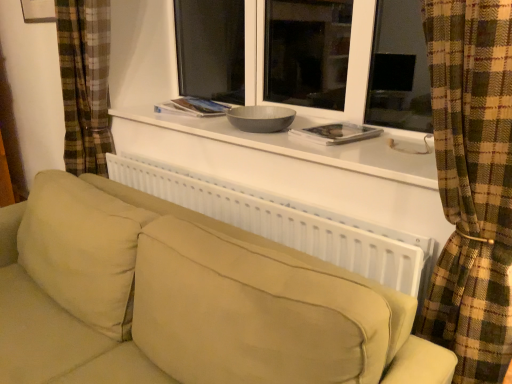
Question: Can you confirm if hardcover book at center, the 1th book from the left, is shorter than white plastic radiator at center?

Choices:
 (A) yes
 (B) no

Answer: (A)

Question: Does hardcover book at center, the 1th book from the left, lie in front of white plastic radiator at center?

Choices:
 (A) no
 (B) yes

Answer: (A)

Question: From a real-world perspective, is hardcover book at center, positioned as the 2th book in right-to-left order, located beneath white plastic radiator at center?

Choices:
 (A) no
 (B) yes

Answer: (A)

Question: From the image's perspective, is hardcover book at center, the second book when ordered from bottom to top, located above white plastic radiator at center?

Choices:
 (A) yes
 (B) no

Answer: (A)

Question: Is hardcover book at center, the 1th book positioned from the back, to the right of white plastic radiator at center from the viewer's perspective?

Choices:
 (A) yes
 (B) no

Answer: (B)

Question: Is hardcover book at center, the 1th book positioned from the back, looking in the opposite direction of white plastic radiator at center?

Choices:
 (A) yes
 (B) no

Answer: (B)

Question: Considering the relative sizes of hardcover book at center, the second book when ordered from bottom to top, and white paper book at center, marked as the 2th book in a left-to-right arrangement, in the image provided, is hardcover book at center, the second book when ordered from bottom to top, wider than white paper book at center, marked as the 2th book in a left-to-right arrangement,?

Choices:
 (A) yes
 (B) no

Answer: (A)

Question: From a real-world perspective, is hardcover book at center, the 1th book positioned from the back, beneath white paper book at center, marked as the 2th book in a left-to-right arrangement?

Choices:
 (A) no
 (B) yes

Answer: (A)

Question: From the image's perspective, is hardcover book at center, the second book when ordered from bottom to top, under white paper book at center, marked as the 2th book in a left-to-right arrangement?

Choices:
 (A) yes
 (B) no

Answer: (B)

Question: Are hardcover book at center, which appears as the 2th book when viewed from the front, and white paper book at center, which is the 2th book in top-to-bottom order, beside each other?

Choices:
 (A) yes
 (B) no

Answer: (B)

Question: Is hardcover book at center, the 1th book when ordered from top to bottom, further to camera compared to white paper book at center, which ranks as the 1th book in right-to-left order?

Choices:
 (A) no
 (B) yes

Answer: (B)

Question: Can you confirm if hardcover book at center, which appears as the 2th book when viewed from the front, is positioned to the left of white paper book at center, marked as the first book in a bottom-to-top arrangement?

Choices:
 (A) no
 (B) yes

Answer: (B)

Question: Is white plastic radiator at center bigger than white matte window sill at upper center?

Choices:
 (A) no
 (B) yes

Answer: (B)